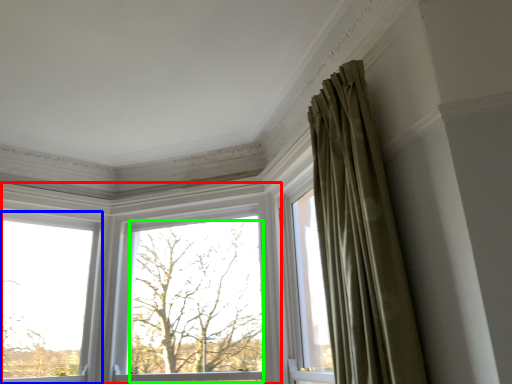
Question: Estimate the real-world distances between objects in this image. Which object is closer to window (highlighted by a red box), window (highlighted by a blue box) or tree (highlighted by a green box)?

Choices:
 (A) window
 (B) tree

Answer: (B)